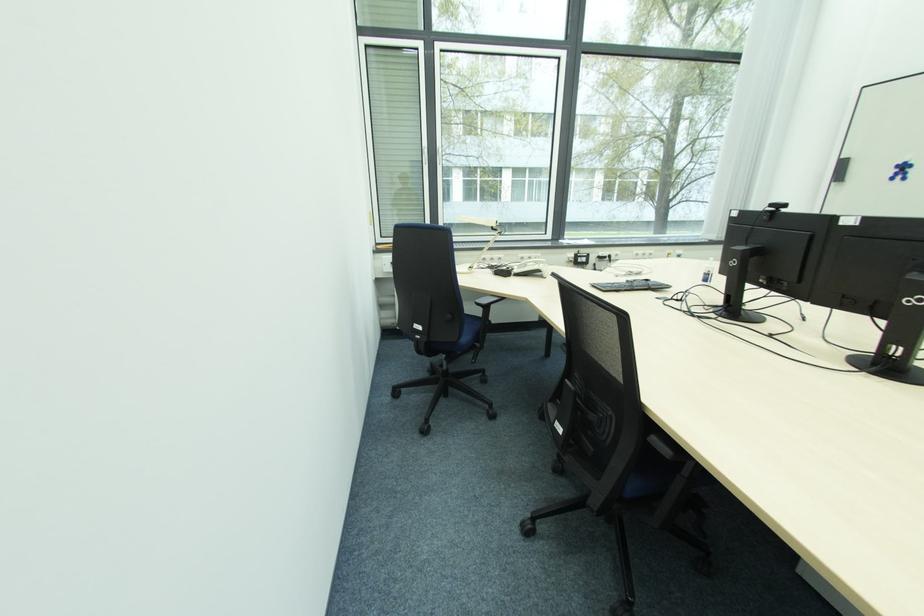
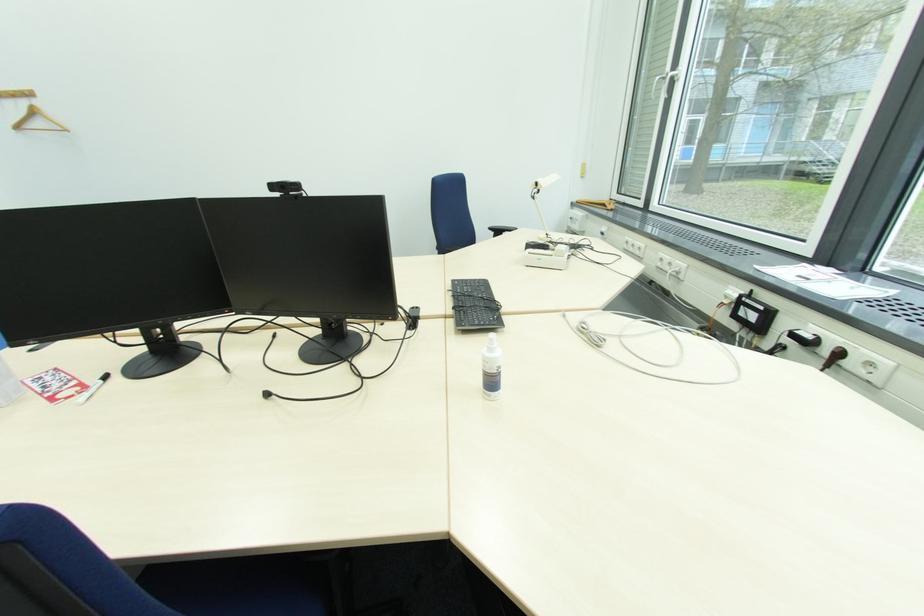
Question: I am providing you with two images of the same scene from different viewpoints. Which of the following objects are not visible in image2?

Choices:
 (A) black webcam
 (B) white window handle
 (C) blue chair sitting surface
 (D) black fluffy slipper

Answer: (C)